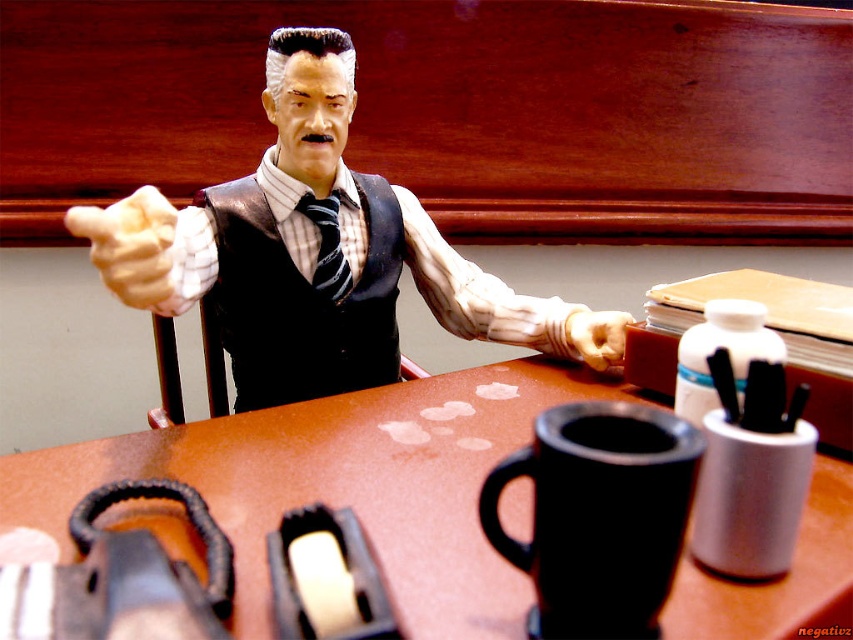
What are the coordinates of the brown matte table at center?

The coordinates of the brown matte table at center are at point (341, 484).

Looking at this image, you are an office assistant who needs to place a new document on the desk. The document must be placed between the matte black vest at center and the black matte coffee cup at lower center. Is this possible?

The matte black vest at center is above the black matte coffee cup at lower center, so there is space between them. Therefore, you can place the document between the matte black vest at center and the black matte coffee cup at lower center.

You are organizing a small party and need to place a decorative centerpiece on the brown matte table at center. However, the matte black vest at center is already occupying space on the table. Based on their sizes, can the centerpiece fit on the table without overlapping the vest?

The brown matte table at center is smaller in size than the matte black vest at center. Since the table is smaller, placing a centerpiece alongside the vest may not be feasible as there might not be enough space. Consider choosing a smaller centerpiece or relocating the vest to accommodate both items.